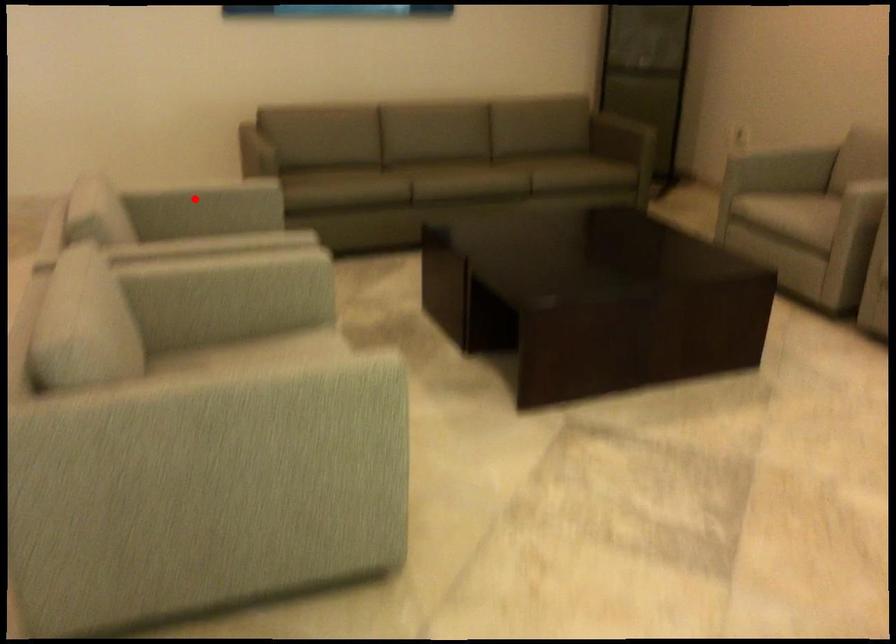
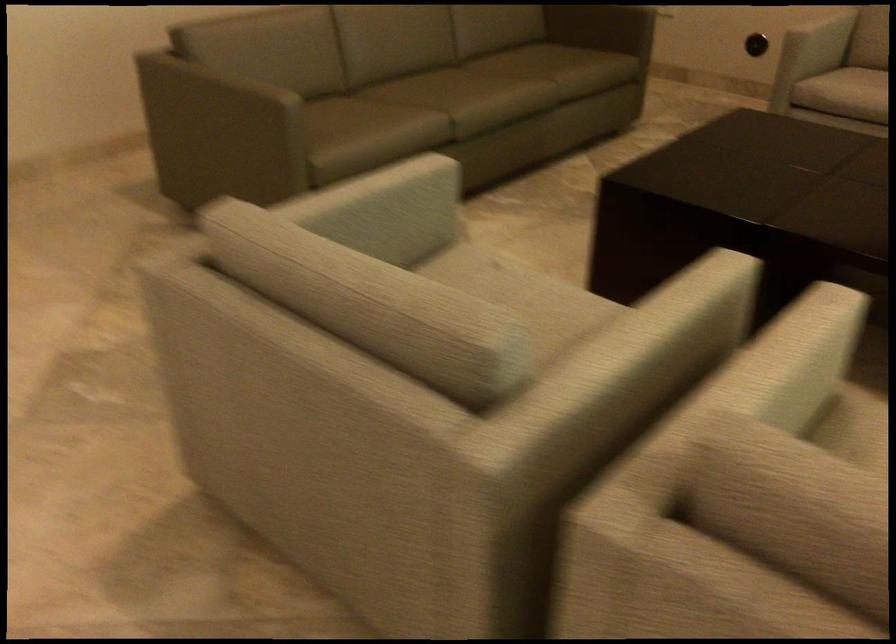
Locate, in the second image, the point that corresponds to the highlighted location in the first image.

(380, 210)